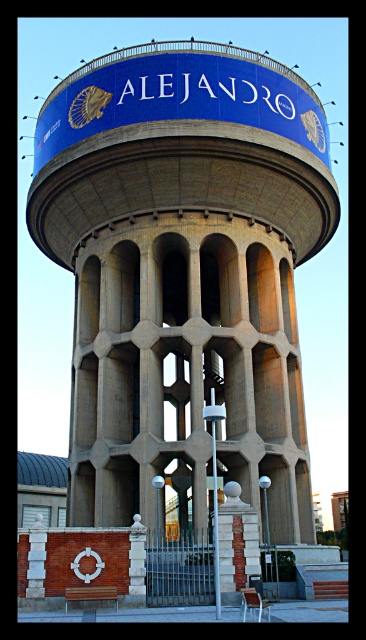
Question: Is concrete water tower at center further to the viewer compared to brick textured column at center?

Choices:
 (A) no
 (B) yes

Answer: (B)

Question: Which of the following is the closest to the observer?

Choices:
 (A) (106, 161)
 (B) (252, 538)

Answer: (B)

Question: Which of the following is the closest to the observer?

Choices:
 (A) brick textured column at center
 (B) concrete water tower at center

Answer: (A)

Question: Observing the image, what is the correct spatial positioning of concrete water tower at center in reference to brick textured column at center?

Choices:
 (A) above
 (B) below

Answer: (A)

Question: Which of the following is the farthest from the observer?

Choices:
 (A) (243, 572)
 (B) (65, 134)

Answer: (B)

Question: Is concrete water tower at center positioned at the back of brick textured column at center?

Choices:
 (A) yes
 (B) no

Answer: (A)